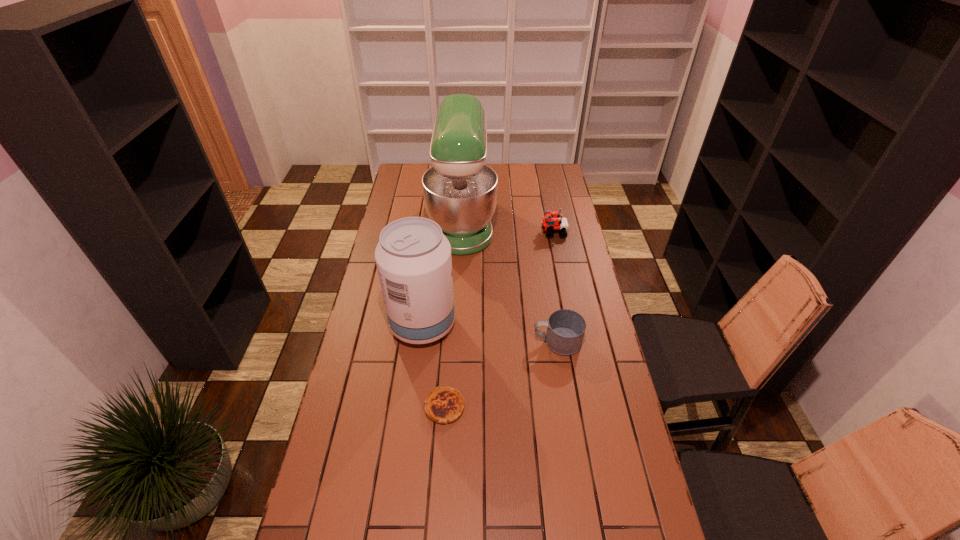
In order to click on mixer in this screenshot , I will do `click(460, 191)`.

Where is `the second tallest object`? The width and height of the screenshot is (960, 540). the second tallest object is located at coordinates (413, 257).

What are the coordinates of `Lego` in the screenshot? It's located at click(x=552, y=223).

Identify the location of the fourth tallest object. (565, 328).

Where is `the shortest object`? the shortest object is located at coordinates (444, 405).

This screenshot has height=540, width=960. Identify the location of the nearest object. (444, 405).

Where is `vacant point located on the controls of the mixer`? The height and width of the screenshot is (540, 960). vacant point located on the controls of the mixer is located at coordinates (523, 222).

Identify the location of vacant space located 0.320m on the back of the alcohol. (432, 249).

Locate an element on the screen. free location located on the front-facing side of the Lego is located at coordinates tap(469, 233).

This screenshot has width=960, height=540. I want to click on vacant space located on the front-facing side of the Lego, so click(478, 233).